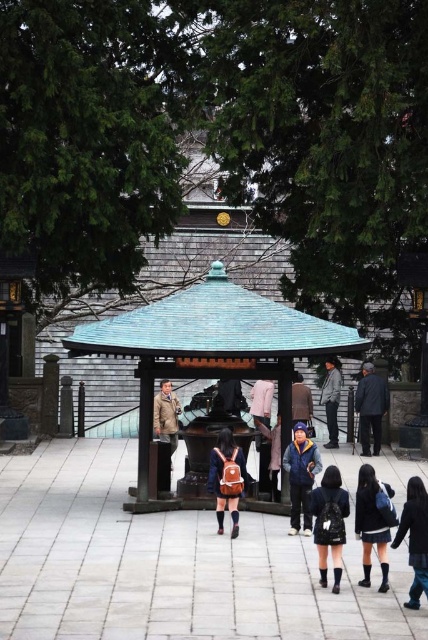
Question: Among these points, which one is farthest from the camera?

Choices:
 (A) (294, 385)
 (B) (377, 387)
 (C) (155, 406)
 (D) (303, 452)

Answer: (A)

Question: Can you confirm if dark blue denim skirt at center is wider than khaki fabric jacket at center?

Choices:
 (A) no
 (B) yes

Answer: (A)

Question: Which point is closer to the camera?

Choices:
 (A) (369, 582)
 (B) (338, 376)

Answer: (A)

Question: Is dark blue denim skirt at lower right in front of dark brown leather jacket at center?

Choices:
 (A) no
 (B) yes

Answer: (B)

Question: Estimate the real-world distances between objects in this image. Which object is closer to the teal shingled gazebo at center?

Choices:
 (A) denim jacket at center
 (B) dark brown leather jacket at center
 (C) dark gray fabric jacket at right

Answer: (A)

Question: Does dark blue denim skirt at lower right appear on the left side of pink fabric pants at center?

Choices:
 (A) no
 (B) yes

Answer: (A)